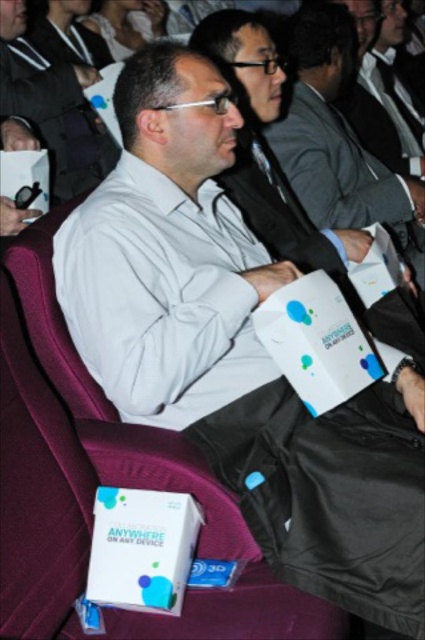
Is point (328, 129) farther from viewer compared to point (57, 26)?

No, (328, 129) is in front of (57, 26).

Based on the photo, can you confirm if dark gray suit at center is positioned to the left of dark gray fabric business suit at upper left?

In fact, dark gray suit at center is to the right of dark gray fabric business suit at upper left.

The height and width of the screenshot is (640, 425). What do you see at coordinates (340, 172) in the screenshot? I see `dark gray suit at center` at bounding box center [340, 172].

Identify the location of dark gray suit at center. The image size is (425, 640). (340, 172).

Who is shorter, dark gray suit at center or matte white box at center?

Standing shorter between the two is dark gray suit at center.

Which of these two, dark gray suit at center or matte white box at center, stands taller?

matte white box at center

At what (x,y) coordinates should I click in order to perform the action: click on dark gray suit at center. Please return your answer as a coordinate pair (x, y). The image size is (425, 640). Looking at the image, I should click on (340, 172).

Based on the photo, which is more to the right, matte white box at center or dark gray fabric business suit at upper left?

dark gray fabric business suit at upper left

What do you see at coordinates (53, 109) in the screenshot?
I see `matte white box at center` at bounding box center [53, 109].

Locate an element on the screen. This screenshot has width=425, height=640. matte white box at center is located at coordinates (53, 109).